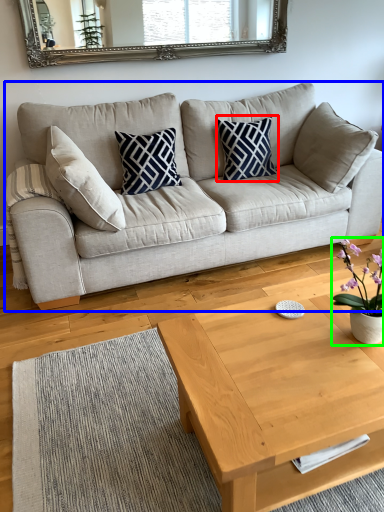
Question: Which is farther away from pillow (highlighted by a red box)? studio couch (highlighted by a blue box) or houseplant (highlighted by a green box)?

Choices:
 (A) studio couch
 (B) houseplant

Answer: (B)